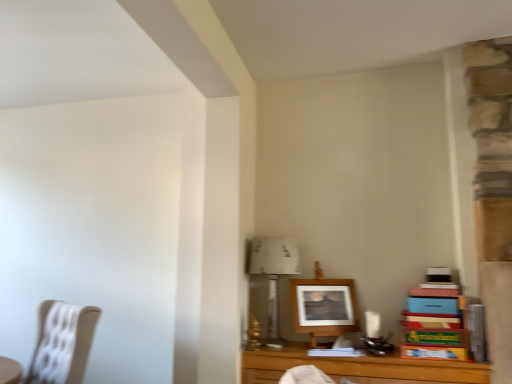
Question: From their relative heights in the image, would you say white paper at upper center is taller or shorter than wooden frame at center?

Choices:
 (A) short
 (B) tall

Answer: (B)

Question: From the image's perspective, is white paper at upper center above or below wooden frame at center?

Choices:
 (A) below
 (B) above

Answer: (B)

Question: Which object is the closest to the wooden table at lower right?

Choices:
 (A) white paper at upper center
 (B) beige fabric chair at left
 (C) wooden frame at center

Answer: (C)

Question: Estimate the real-world distances between objects in this image. Which object is closer to the wooden table at lower right?

Choices:
 (A) wooden frame at center
 (B) beige fabric chair at left
 (C) white paper at upper center

Answer: (A)